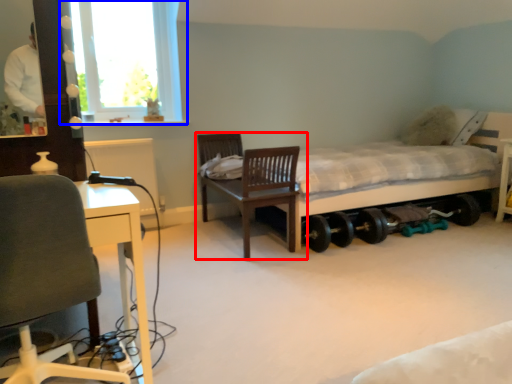
Question: Which object is further to the camera taking this photo, chair (highlighted by a red box) or window (highlighted by a blue box)?

Choices:
 (A) chair
 (B) window

Answer: (B)